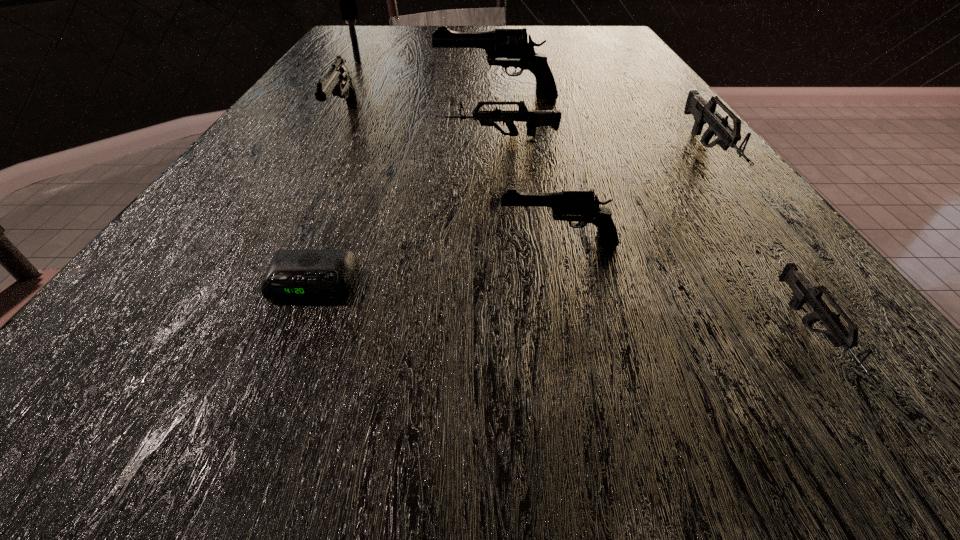
Locate an element on the screen. The image size is (960, 540). free area in between the fifth farthest gun and the rightmost grey gun is located at coordinates (634, 197).

Image resolution: width=960 pixels, height=540 pixels. In order to click on empty space between the second tallest gun and the alarm clock in this screenshot , I will do `click(329, 202)`.

I want to click on vacant space that's between the shortest object and the rightmost object, so click(x=511, y=217).

This screenshot has height=540, width=960. Find the location of `the second closest object to the rightmost grey gun`. the second closest object to the rightmost grey gun is located at coordinates (580, 206).

Locate which object ranks in proximity to the shortest object. Please provide its 2D coordinates. Your answer should be formatted as a tuple, i.e. [(x, y)], where the tuple contains the x and y coordinates of a point satisfying the conditions above.

[(580, 206)]

Identify the location of the second closest gun to the second tallest object. [x=534, y=118].

This screenshot has width=960, height=540. Find the location of `the third closest gun relative to the leftmost grey gun`. the third closest gun relative to the leftmost grey gun is located at coordinates (703, 112).

Find the location of a particular element. black gun that is the closest to the smallest black gun is located at coordinates (338, 80).

Identify the location of black gun that stands as the second closest to the shortest object. The image size is (960, 540). (338, 80).

The image size is (960, 540). I want to click on grey gun that stands as the third closest to the seventh shortest object, so click(804, 292).